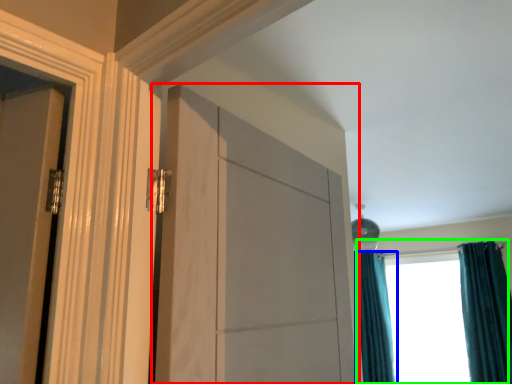
Question: Which is nearer to the door (highlighted by a red box)? curtain (highlighted by a blue box) or window (highlighted by a green box).

Choices:
 (A) curtain
 (B) window

Answer: (B)